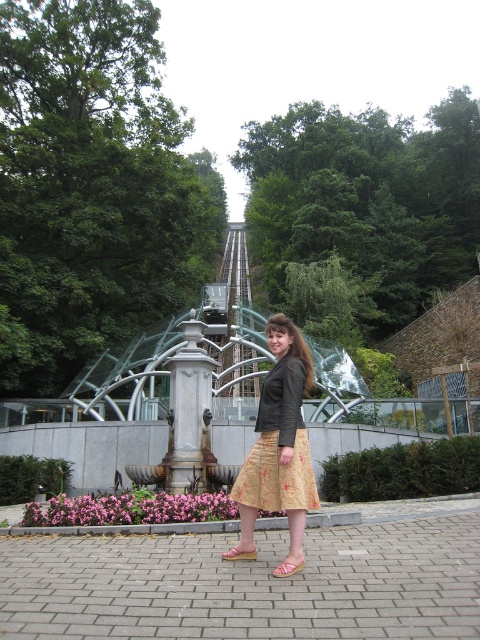
Question: Which point appears farthest from the camera in this image?

Choices:
 (A) (191, 451)
 (B) (232, 550)
 (C) (244, 509)

Answer: (A)

Question: Which point appears farthest from the camera in this image?

Choices:
 (A) (172, 381)
 (B) (296, 570)
 (C) (263, 456)
 (D) (237, 548)

Answer: (A)

Question: Can you confirm if light brown leather sandal at center is wider than pink fabric sandal at center?

Choices:
 (A) yes
 (B) no

Answer: (A)

Question: Does yellow floral skirt at center have a greater width compared to white marble fountain at center?

Choices:
 (A) yes
 (B) no

Answer: (B)

Question: Which of these objects is positioned farthest from the yellow floral skirt at center?

Choices:
 (A) white marble fountain at center
 (B) pink fabric sandal at center

Answer: (A)

Question: Is light brown leather sandal at center above pink fabric sandal at center?

Choices:
 (A) no
 (B) yes

Answer: (A)